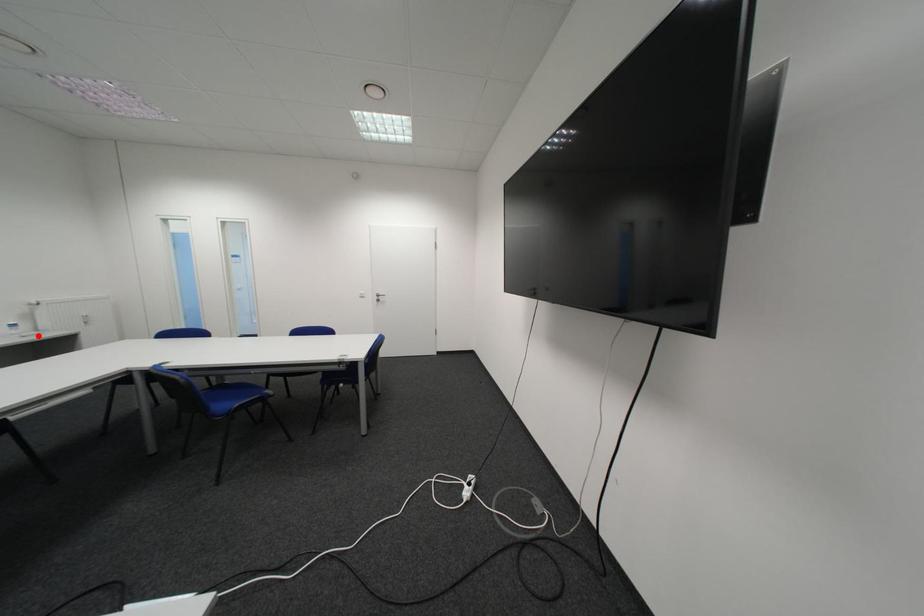
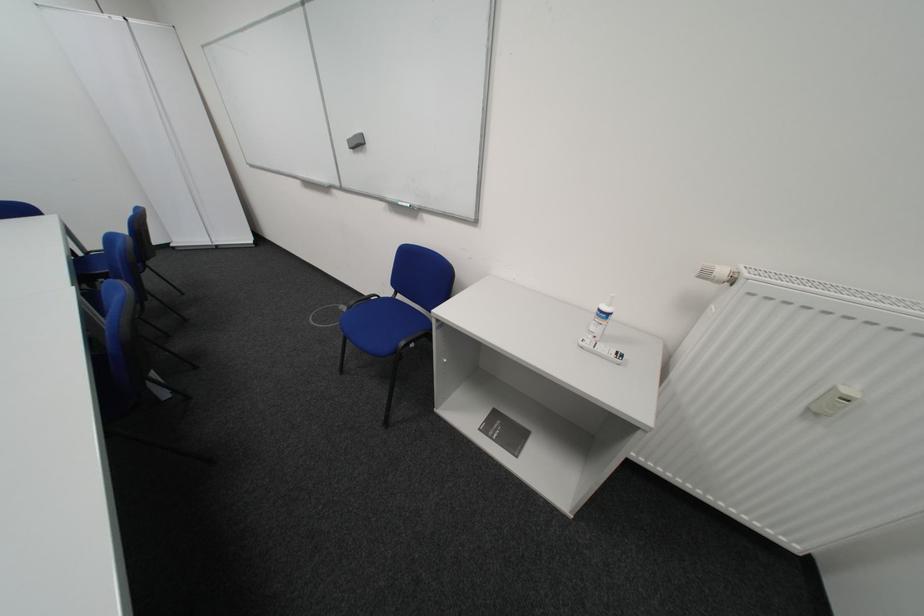
Locate, in the second image, the point that corresponds to the highlighted location in the first image.

(599, 345)